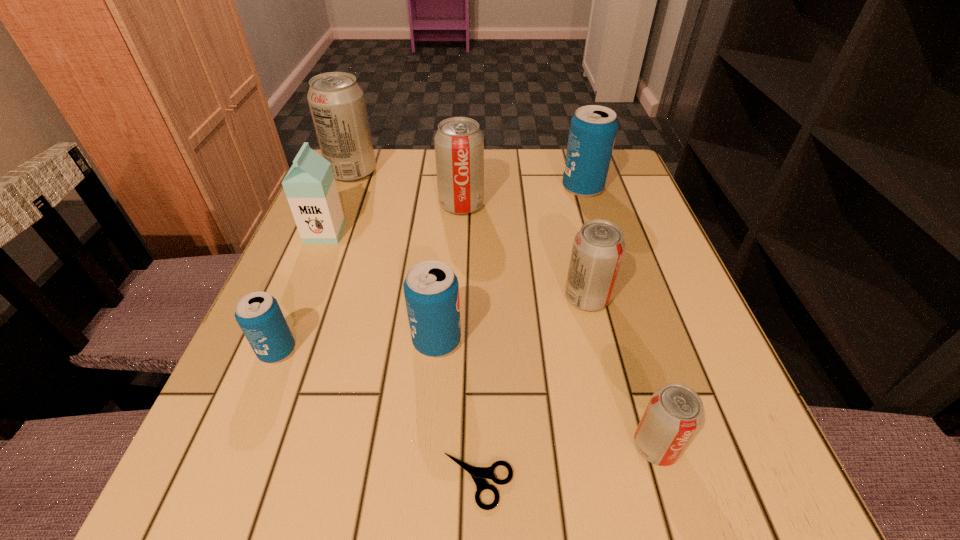
Locate an element on the screen. Image resolution: width=960 pixels, height=540 pixels. the leftmost gray soda can is located at coordinates (337, 103).

Identify the location of the biggest gray soda can. The width and height of the screenshot is (960, 540). (337, 103).

This screenshot has height=540, width=960. I want to click on the farthest blue soda can, so click(x=593, y=128).

The height and width of the screenshot is (540, 960). Find the location of `the rightmost blue soda can`. the rightmost blue soda can is located at coordinates (593, 128).

Identify the location of the third smallest gray soda can. (459, 143).

You are a GUI agent. You are given a task and a screenshot of the screen. Output one action in this format:
    pyautogui.click(x=<x>, y=<y>)
    Task: Click on the second gray soda can from left to right
    This screenshot has height=540, width=960.
    Given the screenshot: What is the action you would take?
    pyautogui.click(x=459, y=143)

Image resolution: width=960 pixels, height=540 pixels. I want to click on milk carton, so click(x=310, y=187).

Find the location of a particular element. white milk carton is located at coordinates (310, 187).

The width and height of the screenshot is (960, 540). Find the location of `the fifth nearest object`. the fifth nearest object is located at coordinates pyautogui.click(x=598, y=248).

Locate an element on the screen. The height and width of the screenshot is (540, 960). the fourth nearest soda can is located at coordinates (598, 248).